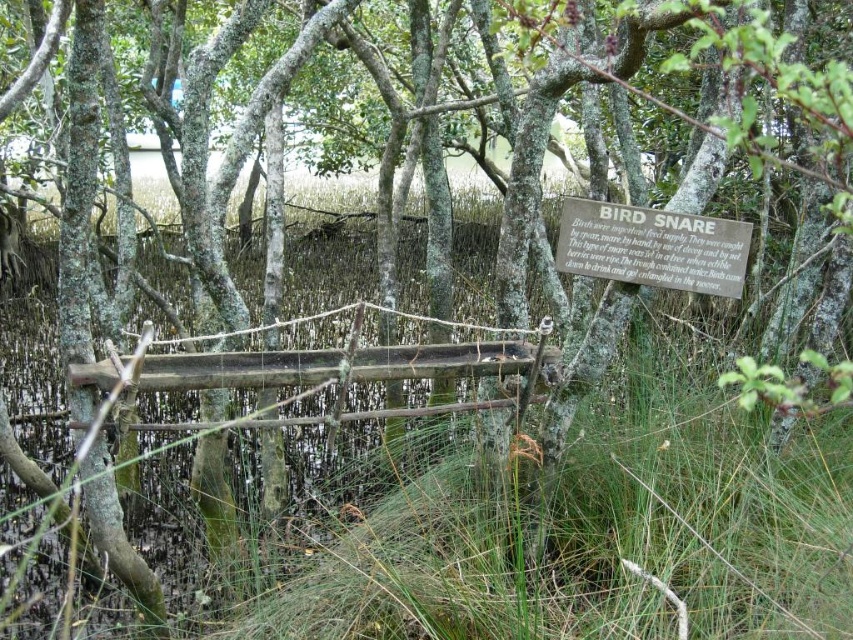
Question: Is smooth wooden plank at center further to camera compared to wooden sign at center?

Choices:
 (A) yes
 (B) no

Answer: (B)

Question: Which point is farther from the camera taking this photo?

Choices:
 (A) (459, 348)
 (B) (730, 272)

Answer: (A)

Question: Is smooth wooden plank at center further to the viewer compared to wooden sign at center?

Choices:
 (A) yes
 (B) no

Answer: (B)

Question: Which object is closer to the camera taking this photo?

Choices:
 (A) wooden sign at center
 (B) smooth wooden plank at center

Answer: (B)

Question: Is smooth wooden plank at center to the right of wooden sign at center from the viewer's perspective?

Choices:
 (A) yes
 (B) no

Answer: (B)